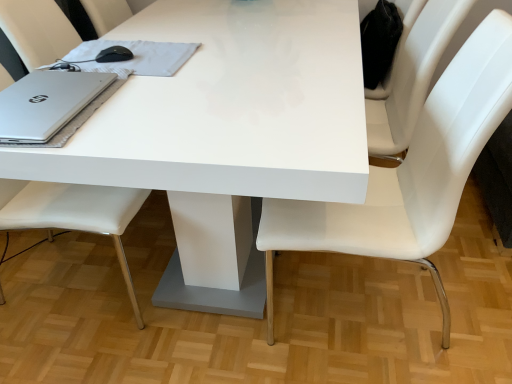
Question: Can you confirm if white leather chair at left, which appears as the first chair when viewed from the left, is positioned to the left of white glossy table at center?

Choices:
 (A) no
 (B) yes

Answer: (B)

Question: Is white leather chair at left, which ranks as the second chair in right-to-left order, bigger than white glossy table at center?

Choices:
 (A) yes
 (B) no

Answer: (B)

Question: Is white leather chair at left, which ranks as the second chair in right-to-left order, behind white glossy table at center?

Choices:
 (A) no
 (B) yes

Answer: (B)

Question: Is white leather chair at left, which ranks as the second chair in right-to-left order, located outside white glossy table at center?

Choices:
 (A) no
 (B) yes

Answer: (A)

Question: Is white leather chair at left, which ranks as the second chair in right-to-left order, in front of or behind white leather chair at center, positioned as the first chair in right-to-left order, in the image?

Choices:
 (A) behind
 (B) front

Answer: (A)

Question: From a real-world perspective, is white leather chair at left, which ranks as the second chair in right-to-left order, physically located above or below white leather chair at center, which is the second chair in left-to-right order?

Choices:
 (A) above
 (B) below

Answer: (A)

Question: From the image's perspective, is white leather chair at left, which appears as the first chair when viewed from the left, located above or below white leather chair at center, which is the second chair in left-to-right order?

Choices:
 (A) below
 (B) above

Answer: (B)

Question: Is point (121, 193) positioned closer to the camera than point (439, 148)?

Choices:
 (A) farther
 (B) closer

Answer: (A)

Question: Is satin silver notebook at upper left bigger or smaller than white glossy table at center?

Choices:
 (A) big
 (B) small

Answer: (B)

Question: From the image's perspective, is satin silver notebook at upper left above or below white glossy table at center?

Choices:
 (A) above
 (B) below

Answer: (A)

Question: In terms of width, does satin silver notebook at upper left look wider or thinner when compared to white glossy table at center?

Choices:
 (A) wide
 (B) thin

Answer: (B)

Question: In the image, is satin silver notebook at upper left on the left side or the right side of white glossy table at center?

Choices:
 (A) right
 (B) left

Answer: (B)

Question: From the image's perspective, is satin silver notebook at upper left positioned above or below white leather chair at left, which ranks as the second chair in right-to-left order?

Choices:
 (A) below
 (B) above

Answer: (B)

Question: From a real-world perspective, is satin silver notebook at upper left physically located above or below white leather chair at left, which appears as the first chair when viewed from the left?

Choices:
 (A) above
 (B) below

Answer: (A)